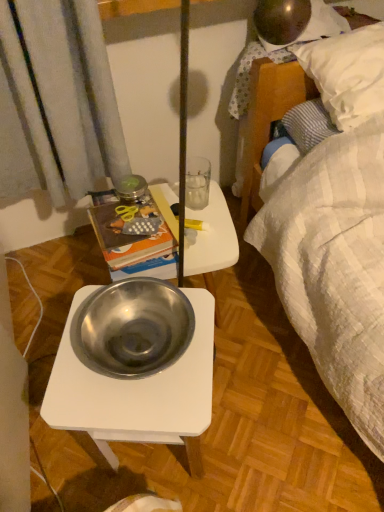
The width and height of the screenshot is (384, 512). Find the location of `vacant region below polished stainless steel bowl at center (from a real-world perspective)`. vacant region below polished stainless steel bowl at center (from a real-world perspective) is located at coordinates (137, 340).